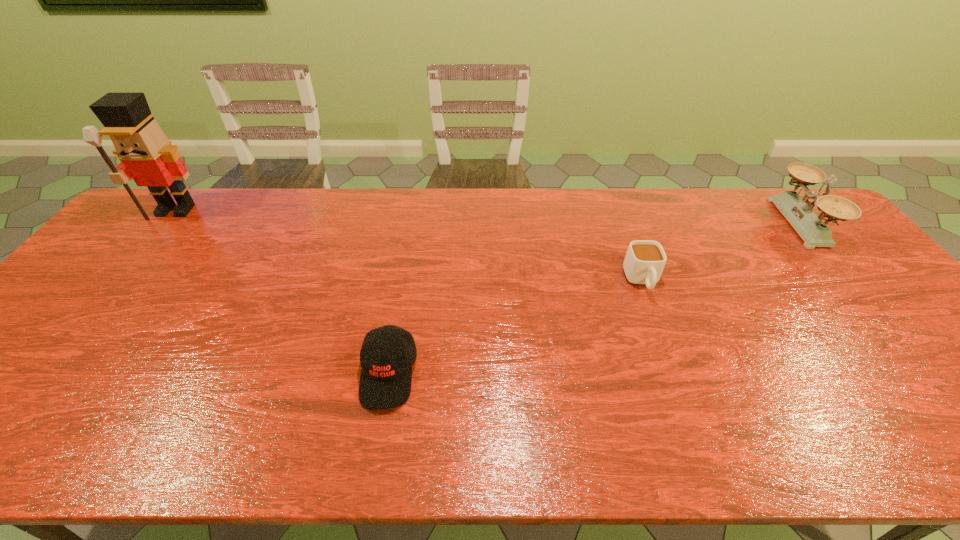
Where is `empty location between the cup and the tallest object`? empty location between the cup and the tallest object is located at coordinates [409, 246].

The width and height of the screenshot is (960, 540). I want to click on blank region between the cup and the second tallest object, so click(721, 252).

The width and height of the screenshot is (960, 540). I want to click on vacant space in between the second object from left to right and the scale, so click(x=594, y=299).

Identify which object is the second closest to the nearest object. Please provide its 2D coordinates. Your answer should be formatted as a tuple, i.e. [(x, y)], where the tuple contains the x and y coordinates of a point satisfying the conditions above.

[(146, 155)]

Identify which object is located as the second nearest to the nutcracker. Please provide its 2D coordinates. Your answer should be formatted as a tuple, i.e. [(x, y)], where the tuple contains the x and y coordinates of a point satisfying the conditions above.

[(644, 262)]

Identify the location of blank area in the image that satisfies the following two spatial constraints: 1. on the front-facing side of the rightmost object; 2. on the front-facing side of the baseball cap. (924, 374).

Locate an element on the screen. The image size is (960, 540). free spot that satisfies the following two spatial constraints: 1. on the front-facing side of the scale; 2. on the side with the handle of the cup is located at coordinates (848, 281).

Where is `free space that satisfies the following two spatial constraints: 1. on the front-facing side of the scale; 2. on the front-facing side of the third object from right to left`? The width and height of the screenshot is (960, 540). free space that satisfies the following two spatial constraints: 1. on the front-facing side of the scale; 2. on the front-facing side of the third object from right to left is located at coordinates (924, 374).